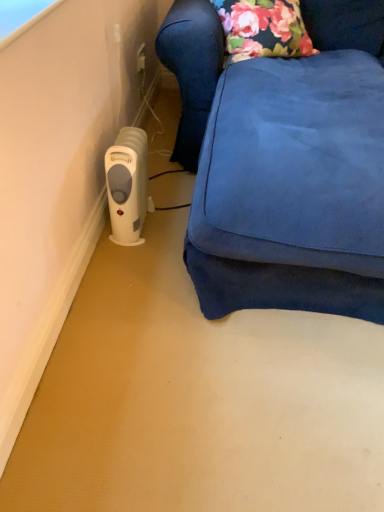
Measure the distance between white plastic heater at left and camera.

3.31 feet.

Describe the element at coordinates (254, 156) in the screenshot. This screenshot has width=384, height=512. I see `white plastic heater at left` at that location.

The width and height of the screenshot is (384, 512). What are the coordinates of `white plastic heater at left` in the screenshot? It's located at (254, 156).

Looking at this image, measure the distance between point (193, 86) and camera.

The distance of point (193, 86) from camera is 5.51 feet.

What do you see at coordinates (127, 185) in the screenshot? I see `white plastic heater at lower left` at bounding box center [127, 185].

Identify the location of white plastic heater at lower left. (127, 185).

Locate an element on the screen. white plastic heater at left is located at coordinates (254, 156).

Can you confirm if white plastic heater at left is positioned to the right of white plastic heater at lower left?

Yes.

Is the position of white plastic heater at left more distant than that of white plastic heater at lower left?

No, white plastic heater at left is closer to the viewer.

Is point (230, 108) farther from viewer compared to point (137, 170)?

No.

From the image's perspective, is white plastic heater at left below white plastic heater at lower left?

No, from the image's perspective, white plastic heater at left is not beneath white plastic heater at lower left.

From a real-world perspective, is white plastic heater at left under white plastic heater at lower left?

No, from a real-world perspective, white plastic heater at left is not beneath white plastic heater at lower left.

Which of these two, white plastic heater at left or white plastic heater at lower left, is wider?

white plastic heater at left.

Considering the relative sizes of white plastic heater at left and white plastic heater at lower left in the image provided, is white plastic heater at left taller than white plastic heater at lower left?

Indeed, white plastic heater at left has a greater height compared to white plastic heater at lower left.

Does white plastic heater at left have a larger size compared to white plastic heater at lower left?

Yes.

Is white plastic heater at left situated inside white plastic heater at lower left or outside?

The correct answer is: outside.

Is white plastic heater at left far from white plastic heater at lower left?

No, white plastic heater at left is in close proximity to white plastic heater at lower left.

Does white plastic heater at left turn towards white plastic heater at lower left?

No, white plastic heater at left is not aimed at white plastic heater at lower left.

Identify the location of home appliance on the left of white plastic heater at left. This screenshot has height=512, width=384. (127, 185).

Is white plastic heater at lower left to the left or to the right of white plastic heater at left in the image?

Clearly, white plastic heater at lower left is on the left of white plastic heater at left in the image.

Considering the relative positions of white plastic heater at lower left and white plastic heater at left in the image provided, is white plastic heater at lower left behind white plastic heater at left?

Yes, it is.

Which point is more forward, (126, 177) or (306, 67)?

Positioned in front is point (126, 177).

From the image's perspective, is white plastic heater at lower left located beneath white plastic heater at left?

Correct, white plastic heater at lower left appears lower than white plastic heater at left in the image.

From a real-world perspective, who is located lower, white plastic heater at lower left or white plastic heater at left?

white plastic heater at lower left is physically lower.

Which of these two, white plastic heater at lower left or white plastic heater at left, is thinner?

Thinner between the two is white plastic heater at lower left.

Between white plastic heater at lower left and white plastic heater at left, which one has more height?

Standing taller between the two is white plastic heater at left.

Considering the relative sizes of white plastic heater at lower left and white plastic heater at left in the image provided, is white plastic heater at lower left bigger than white plastic heater at left?

Incorrect, white plastic heater at lower left is not larger than white plastic heater at left.

From the picture: Is white plastic heater at left located within white plastic heater at lower left?

No, white plastic heater at left is not a part of white plastic heater at lower left.

Is the surface of white plastic heater at lower left in direct contact with white plastic heater at left?

They are not placed beside each other.

Based on the photo, is white plastic heater at lower left oriented towards white plastic heater at left?

Yes, white plastic heater at lower left is turned towards white plastic heater at left.

What's the angular difference between white plastic heater at lower left and white plastic heater at left's facing directions?

There is a 3.24-degree angle between the facing directions of white plastic heater at lower left and white plastic heater at left.

In the image, there is a white plastic heater at left. At what (x,y) coordinates should I click in order to perform the action: click on home appliance below it (from a real-world perspective). Please return your answer as a coordinate pair (x, y). This screenshot has height=512, width=384. Looking at the image, I should click on (127, 185).

Locate an element on the screen. The height and width of the screenshot is (512, 384). home appliance on the left of white plastic heater at left is located at coordinates (127, 185).

This screenshot has width=384, height=512. What are the coordinates of `furniture above the white plastic heater at lower left (from the image's perspective)` in the screenshot? It's located at (254, 156).